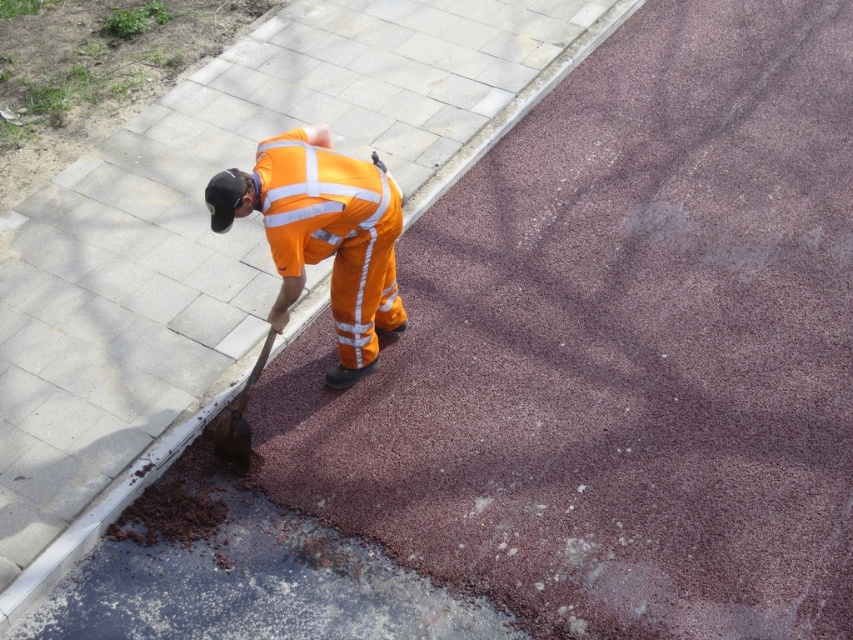
Can you confirm if high-visibility fabric safety vest at center is bigger than wooden shovel at lower center?

No, high-visibility fabric safety vest at center is not bigger than wooden shovel at lower center.

Find the location of a particular element. high-visibility fabric safety vest at center is located at coordinates [x=318, y=200].

Locate an element on the screen. The height and width of the screenshot is (640, 853). high-visibility fabric safety vest at center is located at coordinates (318, 200).

Who is higher up, high-visibility orange reflective jumpsuit at center or high-visibility fabric safety vest at center?

Positioned higher is high-visibility fabric safety vest at center.

Between high-visibility orange reflective jumpsuit at center and high-visibility fabric safety vest at center, which one appears on the right side from the viewer's perspective?

From the viewer's perspective, high-visibility fabric safety vest at center appears more on the right side.

The width and height of the screenshot is (853, 640). I want to click on high-visibility orange reflective jumpsuit at center, so click(x=323, y=236).

Can you confirm if high-visibility orange reflective jumpsuit at center is smaller than wooden shovel at lower center?

Actually, high-visibility orange reflective jumpsuit at center might be larger than wooden shovel at lower center.

What do you see at coordinates (323, 236) in the screenshot? This screenshot has width=853, height=640. I see `high-visibility orange reflective jumpsuit at center` at bounding box center [323, 236].

The width and height of the screenshot is (853, 640). Find the location of `high-visibility orange reflective jumpsuit at center`. high-visibility orange reflective jumpsuit at center is located at coordinates (323, 236).